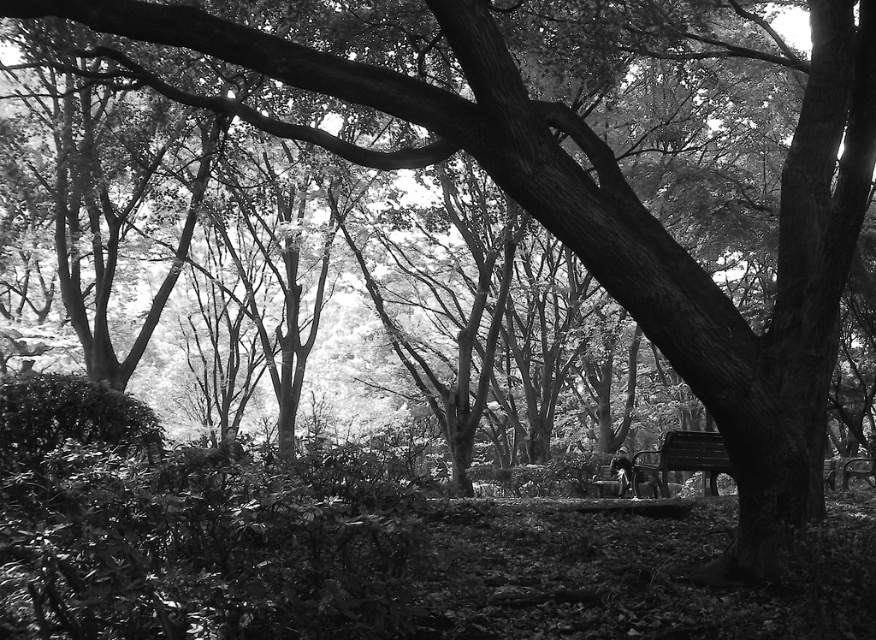
You are standing in the park and want to sit on the wooden bench at center. Based on the coordinates provided, can you confirm if the point marked at [682,460] is the correct location for the wooden bench at center?

Yes, the point marked at [682,460] corresponds to the wooden bench at center according to the description.

You are standing in the park and want to reach a specific point marked at coordinates point (634, 492). Given that you can walk 25 feet in 1 minute, how long will it take you to reach that point?

The distance of point (634, 492) from viewer is 21.04 feet. At a walking speed of 25 feet per minute, it would take approximately 0.84 minutes, which is about 50 seconds, to reach the point.

Looking at this image, you are sitting on the wooden bench at center in the park. You want to place your smooth black jacket at center on the bench so it doesn not get dirty. Where should you put it to ensure it stays on the bench without falling off?

Since the wooden bench at center is in front of the smooth black jacket at center, you should place the smooth black jacket at center on the part of the bench that is closest to you, ensuring it stays on the bench and doesn not fall off.